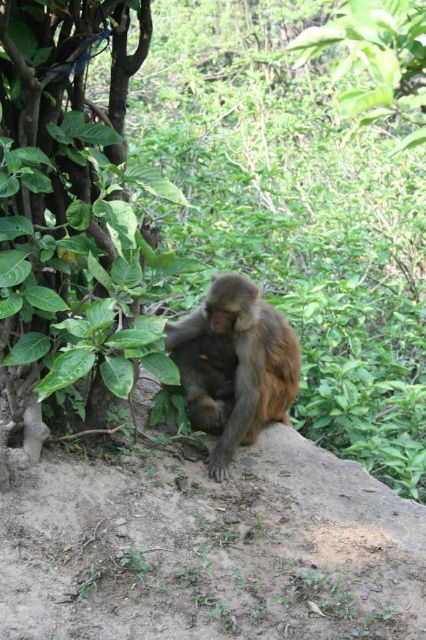
Question: Among these objects, which one is farthest from the camera?

Choices:
 (A) green leafy tree at left
 (B) brown furry monkey at center

Answer: (B)

Question: Observing the image, what is the correct spatial positioning of green leafy tree at left in reference to brown furry monkey at center?

Choices:
 (A) above
 (B) below

Answer: (A)

Question: Which point is farther to the camera?

Choices:
 (A) (149, 257)
 (B) (270, 323)

Answer: (B)

Question: Is green leafy tree at left above brown furry monkey at center?

Choices:
 (A) no
 (B) yes

Answer: (B)

Question: Can you confirm if green leafy tree at left is smaller than brown furry monkey at center?

Choices:
 (A) yes
 (B) no

Answer: (B)